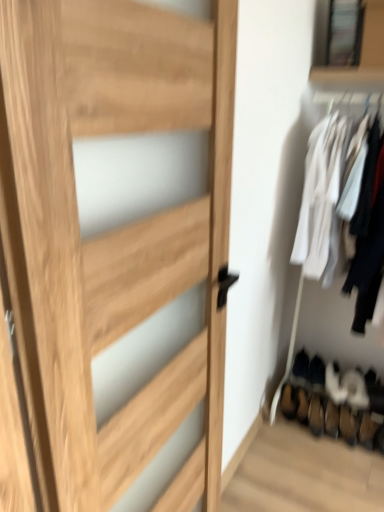
The width and height of the screenshot is (384, 512). What are the coordinates of `white suede shoe at lower right, placed as the fourth shoe when sorted from left to right` in the screenshot? It's located at (355, 390).

Locate an element on the screen. brown suede shoe at lower right, the first shoe positioned from the left is located at coordinates (289, 401).

How much space does black suede shoe at lower right, which ranks as the 2th shoe in left-to-right order, occupy horizontally?

10.42 inches.

What do you see at coordinates (111, 234) in the screenshot? The width and height of the screenshot is (384, 512). I see `natural wood door at center` at bounding box center [111, 234].

This screenshot has height=512, width=384. What do you see at coordinates (374, 392) in the screenshot?
I see `white suede shoe at lower right, the 1th shoe positioned from the right` at bounding box center [374, 392].

Locate an element on the screen. This screenshot has height=512, width=384. white suede shoe at lower right, placed as the fourth shoe when sorted from left to right is located at coordinates (355, 390).

From a real-world perspective, does brown suede shoe at lower right, the first shoe positioned from the left, sit lower than white suede shoe at lower right, the 3th shoe from the right?

Yes, from a real-world perspective, brown suede shoe at lower right, the first shoe positioned from the left, is below white suede shoe at lower right, the 3th shoe from the right.

Which point is more distant from viewer, (291, 390) or (345, 392)?

The point (291, 390) is more distant.

Which object is positioned more to the left, brown suede shoe at lower right, the first shoe positioned from the left, or white suede shoe at lower right, which is counted as the 3th shoe, starting from the left?

Positioned to the left is brown suede shoe at lower right, the first shoe positioned from the left.

From a real-world perspective, is white suede shoe at lower right, placed as the fourth shoe when sorted from left to right, on natural wood door at center?

Incorrect, from a real-world perspective, white suede shoe at lower right, placed as the fourth shoe when sorted from left to right, is lower than natural wood door at center.

How many degrees apart are the facing directions of white suede shoe at lower right, placed as the fourth shoe when sorted from left to right, and natural wood door at center?

There is a 79.2-degree angle between the facing directions of white suede shoe at lower right, placed as the fourth shoe when sorted from left to right, and natural wood door at center.

Considering the positions of objects white suede shoe at lower right, placed as the fourth shoe when sorted from left to right, and natural wood door at center in the image provided, who is more to the right, white suede shoe at lower right, placed as the fourth shoe when sorted from left to right, or natural wood door at center?

Positioned to the right is white suede shoe at lower right, placed as the fourth shoe when sorted from left to right.

Which of these two, white suede shoe at lower right, the 3th shoe from the right, or white suede shoe at lower right, placed as the second shoe when sorted from right to left, stands shorter?

white suede shoe at lower right, placed as the second shoe when sorted from right to left.

In terms of width, does white suede shoe at lower right, which is counted as the 3th shoe, starting from the left, look wider or thinner when compared to white suede shoe at lower right, placed as the second shoe when sorted from right to left?

Considering their sizes, white suede shoe at lower right, which is counted as the 3th shoe, starting from the left, looks broader than white suede shoe at lower right, placed as the second shoe when sorted from right to left.

Considering the positions of objects white suede shoe at lower right, the 3th shoe from the right, and white suede shoe at lower right, placed as the fourth shoe when sorted from left to right, in the image provided, who is more to the left, white suede shoe at lower right, the 3th shoe from the right, or white suede shoe at lower right, placed as the fourth shoe when sorted from left to right,?

white suede shoe at lower right, the 3th shoe from the right.

At what (x,y) coordinates should I click in order to perform the action: click on shoe that is the 1st object above the white suede shoe at lower right, placed as the second shoe when sorted from right to left (from a real-world perspective). Please return your answer as a coordinate pair (x, y). This screenshot has height=512, width=384. Looking at the image, I should click on (334, 384).

Which object is more forward, natural wood door at center or brown suede shoe at lower right, the first shoe positioned from the left?

natural wood door at center is in front.

Which of these two, natural wood door at center or brown suede shoe at lower right, which ranks as the fifth shoe in right-to-left order, is wider?

Wider between the two is natural wood door at center.

From the image's perspective, is natural wood door at center above or below brown suede shoe at lower right, the first shoe positioned from the left?

From the image's perspective, natural wood door at center appears above brown suede shoe at lower right, the first shoe positioned from the left.

Consider the image. Is brown suede shoe at lower right, the first shoe positioned from the left, surrounded by natural wood door at center?

That's incorrect, brown suede shoe at lower right, the first shoe positioned from the left, is not inside natural wood door at center.

How many degrees apart are the facing directions of brown suede shoe at lower right, which ranks as the fifth shoe in right-to-left order, and natural wood door at center?

The facing directions of brown suede shoe at lower right, which ranks as the fifth shoe in right-to-left order, and natural wood door at center are 91.5 degrees apart.

From a real-world perspective, is brown suede shoe at lower right, the first shoe positioned from the left, physically above natural wood door at center?

Actually, brown suede shoe at lower right, the first shoe positioned from the left, is physically below natural wood door at center in the real world.

At what (x,y) coordinates should I click in order to perform the action: click on door above the brown suede shoe at lower right, which ranks as the fifth shoe in right-to-left order (from a real-world perspective). Please return your answer as a coordinate pair (x, y). Image resolution: width=384 pixels, height=512 pixels. Looking at the image, I should click on (111, 234).

Is point (290, 390) closer to viewer compared to point (87, 257)?

No, (290, 390) is further to viewer.

Does black suede shoe at lower right, which ranks as the 2th shoe in left-to-right order, have a greater width compared to white suede shoe at lower right, placed as the fourth shoe when sorted from left to right?

In fact, black suede shoe at lower right, which ranks as the 2th shoe in left-to-right order, might be narrower than white suede shoe at lower right, placed as the fourth shoe when sorted from left to right.

Are black suede shoe at lower right, which ranks as the 2th shoe in left-to-right order, and white suede shoe at lower right, placed as the fourth shoe when sorted from left to right, far apart?

That's not correct — black suede shoe at lower right, which ranks as the 2th shoe in left-to-right order, is a little close to white suede shoe at lower right, placed as the fourth shoe when sorted from left to right.

Does black suede shoe at lower right, marked as the 4th shoe in a right-to-left arrangement, come behind white suede shoe at lower right, placed as the second shoe when sorted from right to left?

Yes, the depth of black suede shoe at lower right, marked as the 4th shoe in a right-to-left arrangement, is greater than that of white suede shoe at lower right, placed as the second shoe when sorted from right to left.

Could you measure the distance between black suede shoe at lower right, marked as the 4th shoe in a right-to-left arrangement, and white suede shoe at lower right, placed as the fourth shoe when sorted from left to right?

They are 9.43 inches apart.

Based on the photo, considering the relative sizes of white suede shoe at lower right, which is counted as the 3th shoe, starting from the left, and white suede shoe at lower right, which is the fifth shoe in left-to-right order, in the image provided, is white suede shoe at lower right, which is counted as the 3th shoe, starting from the left, taller than white suede shoe at lower right, which is the fifth shoe in left-to-right order,?

No.

From the image's perspective, between white suede shoe at lower right, which is counted as the 3th shoe, starting from the left, and white suede shoe at lower right, the 1th shoe positioned from the right, who is located below?

white suede shoe at lower right, the 1th shoe positioned from the right.

Is white suede shoe at lower right, which is counted as the 3th shoe, starting from the left, bigger than white suede shoe at lower right, which is the fifth shoe in left-to-right order?

Indeed, white suede shoe at lower right, which is counted as the 3th shoe, starting from the left, has a larger size compared to white suede shoe at lower right, which is the fifth shoe in left-to-right order.

Are white suede shoe at lower right, the 3th shoe from the right, and white suede shoe at lower right, the 1th shoe positioned from the right, located far from each other?

Actually, white suede shoe at lower right, the 3th shoe from the right, and white suede shoe at lower right, the 1th shoe positioned from the right, are a little close together.

Which shoe is the 1st one when counting from the front of the brown suede shoe at lower right, the first shoe positioned from the left? Please provide its 2D coordinates.

[(334, 384)]

Find the location of a particular element. shoe that is the 4th object to the right of the natural wood door at center, starting at the anchor is located at coordinates pos(355,390).

Estimate the real-world distances between objects in this image. Which object is further from natural wood door at center, brown suede shoe at lower right, the first shoe positioned from the left, or white suede shoe at lower right, the 1th shoe positioned from the right?

white suede shoe at lower right, the 1th shoe positioned from the right.

From the image, which object appears to be farther from white suede shoe at lower right, which is the fifth shoe in left-to-right order, black suede shoe at lower right, marked as the 4th shoe in a right-to-left arrangement, or brown suede shoe at lower right, which ranks as the fifth shoe in right-to-left order?

The object further to white suede shoe at lower right, which is the fifth shoe in left-to-right order, is brown suede shoe at lower right, which ranks as the fifth shoe in right-to-left order.

Looking at this image, estimate the real-world distances between objects in this image. Which object is further from white suede shoe at lower right, the 3th shoe from the right, brown suede shoe at lower right, the first shoe positioned from the left, or white suede shoe at lower right, the 1th shoe positioned from the right?

brown suede shoe at lower right, the first shoe positioned from the left.

Which object lies further to the anchor point natural wood door at center, white suede shoe at lower right, which is counted as the 3th shoe, starting from the left, or white suede shoe at lower right, placed as the second shoe when sorted from right to left?

white suede shoe at lower right, placed as the second shoe when sorted from right to left.

Looking at the image, which one is located closer to natural wood door at center, white suede shoe at lower right, placed as the second shoe when sorted from right to left, or white suede shoe at lower right, which is the fifth shoe in left-to-right order?

white suede shoe at lower right, placed as the second shoe when sorted from right to left, is positioned closer to the anchor natural wood door at center.

Looking at the image, which one is located further to white suede shoe at lower right, placed as the fourth shoe when sorted from left to right, black suede shoe at lower right, which ranks as the 2th shoe in left-to-right order, or natural wood door at center?

Among the two, natural wood door at center is located further to white suede shoe at lower right, placed as the fourth shoe when sorted from left to right.

Based on their spatial positions, is white suede shoe at lower right, placed as the second shoe when sorted from right to left, or black suede shoe at lower right, which ranks as the 2th shoe in left-to-right order, further from white suede shoe at lower right, the 1th shoe positioned from the right?

Based on the image, black suede shoe at lower right, which ranks as the 2th shoe in left-to-right order, appears to be further to white suede shoe at lower right, the 1th shoe positioned from the right.

Estimate the real-world distances between objects in this image. Which object is closer to brown suede shoe at lower right, the first shoe positioned from the left, white suede shoe at lower right, placed as the second shoe when sorted from right to left, or white suede shoe at lower right, which is the fifth shoe in left-to-right order?

The object closer to brown suede shoe at lower right, the first shoe positioned from the left, is white suede shoe at lower right, placed as the second shoe when sorted from right to left.

Image resolution: width=384 pixels, height=512 pixels. I want to click on shoe situated between white suede shoe at lower right, the 3th shoe from the right, and white suede shoe at lower right, the 1th shoe positioned from the right, from left to right, so click(x=355, y=390).

Locate an element on the screen. shoe positioned between natural wood door at center and white suede shoe at lower right, the 3th shoe from the right, from near to far is located at coordinates (355, 390).

Identify the location of shoe between black suede shoe at lower right, marked as the 4th shoe in a right-to-left arrangement, and white suede shoe at lower right, placed as the fourth shoe when sorted from left to right, from left to right. This screenshot has height=512, width=384. (334, 384).

Locate an element on the screen. The height and width of the screenshot is (512, 384). shoe between brown suede shoe at lower right, which ranks as the fifth shoe in right-to-left order, and white suede shoe at lower right, the 3th shoe from the right, from left to right is located at coordinates (300, 369).